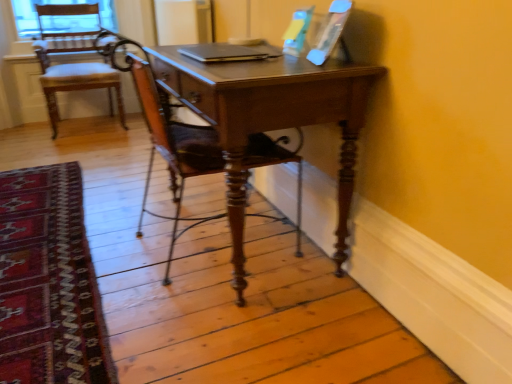
Locate an element on the screen. The height and width of the screenshot is (384, 512). unoccupied region to the right of carpet with intricate patterns at lower left is located at coordinates (x=197, y=252).